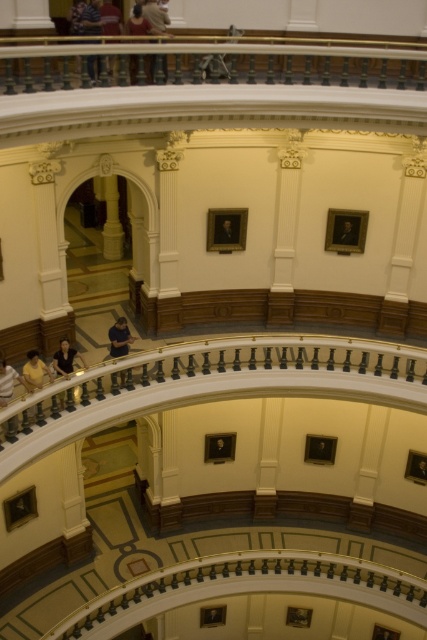
Is matte black shirt at upper center closer to camera compared to matte yellow shirt at lower left?

No.

What do you see at coordinates (140, 22) in the screenshot? The image size is (427, 640). I see `matte black shirt at upper center` at bounding box center [140, 22].

Who is more forward, [131,61] or [38,364]?

Point [131,61] is in front.

You are a GUI agent. You are given a task and a screenshot of the screen. Output one action in this format:
    pyautogui.click(x=<x>, y=<y>)
    Task: Click on the matte black shirt at upper center
    
    Given the screenshot: What is the action you would take?
    coord(140,22)

Is matte yellow shirt at lower left further to camera compared to formal black suit at upper center?

No.

Which is in front, point (38, 364) or point (341, 243)?

Point (38, 364) is in front.

Is point (32, 364) positioned behind point (342, 228)?

No, it is not.

Identify the location of matte yellow shirt at lower left. (35, 371).

Can you confirm if matte yellow shirt at lower left is positioned above dark blue shirt at lower left?

Indeed, matte yellow shirt at lower left is positioned over dark blue shirt at lower left.

Between point (34, 356) and point (0, 372), which one is positioned in front?

Point (0, 372) is in front.

Who is more forward, [32,388] or [2,385]?

Positioned in front is point [2,385].

This screenshot has width=427, height=640. Find the location of `matte yellow shirt at lower left`. matte yellow shirt at lower left is located at coordinates (35, 371).